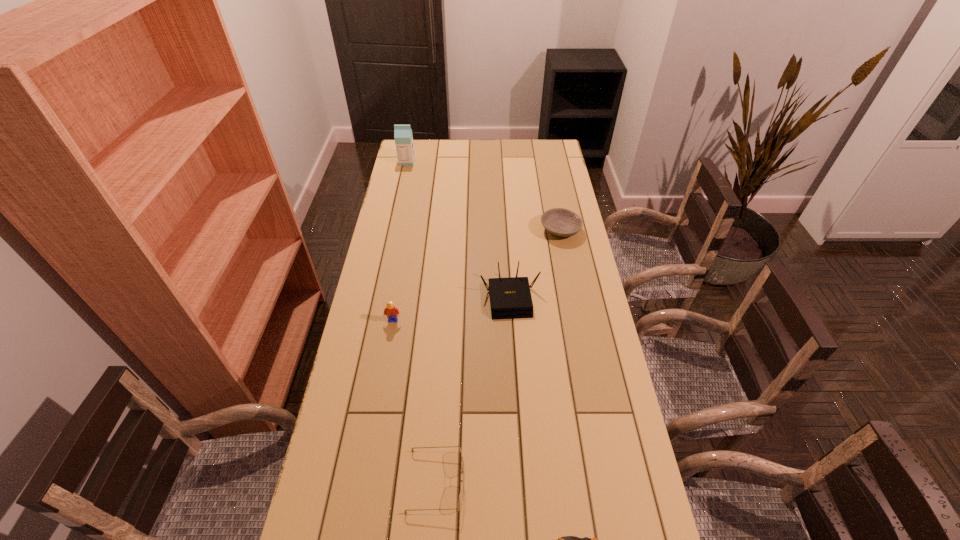
Identify the location of the farthest object. This screenshot has height=540, width=960. (403, 137).

Identify the location of the tallest object. The image size is (960, 540). click(x=403, y=137).

Find the location of a particular element. Image resolution: width=960 pixels, height=540 pixels. the second object from left to right is located at coordinates (390, 311).

Locate an element on the screen. Image resolution: width=960 pixels, height=540 pixels. router is located at coordinates (510, 298).

Find the location of a particular element. The width and height of the screenshot is (960, 540). bowl is located at coordinates tap(562, 222).

This screenshot has height=540, width=960. What are the coordinates of `the fifth farthest object` in the screenshot? It's located at (460, 500).

The width and height of the screenshot is (960, 540). Find the location of `the fourth object from right to left`. the fourth object from right to left is located at coordinates (460, 500).

Image resolution: width=960 pixels, height=540 pixels. In order to click on vacant space located on the right of the tallest object in this screenshot , I will do `click(464, 161)`.

At what (x,y) coordinates should I click in order to perform the action: click on vacant point located on the front-facing side of the Lego. Please return your answer as a coordinate pair (x, y). Image resolution: width=960 pixels, height=540 pixels. Looking at the image, I should click on (388, 354).

Find the location of a particular element. Image resolution: width=960 pixels, height=540 pixels. free space located 0.090m on the front of the router is located at coordinates (513, 342).